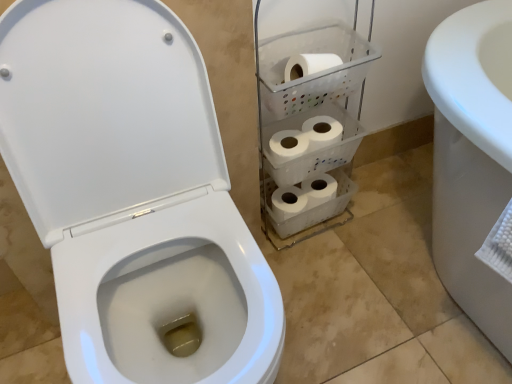
Question: Is white matte toilet paper at center situated inside white glossy toilet at left or outside?

Choices:
 (A) inside
 (B) outside

Answer: (B)

Question: From a real-world perspective, is white matte toilet paper at center physically located above or below white glossy toilet at left?

Choices:
 (A) below
 (B) above

Answer: (B)

Question: Estimate the real-world distances between objects in this image. Which object is closer to the white matte toilet paper at center?

Choices:
 (A) white plastic shelf at center
 (B) white glossy toilet at left

Answer: (A)

Question: Estimate the real-world distances between objects in this image. Which object is farther from the white glossy toilet at left?

Choices:
 (A) white plastic shelf at center
 (B) white matte toilet paper at center

Answer: (B)